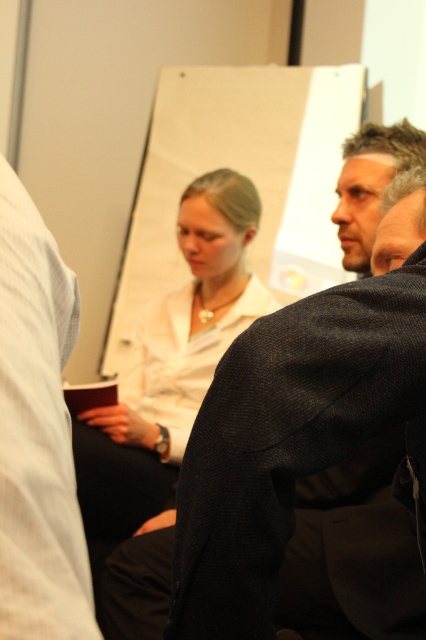
Question: Is white shirt at left bigger than white matte shirt at center?

Choices:
 (A) yes
 (B) no

Answer: (B)

Question: Estimate the real-world distances between objects in this image. Which object is farther from the white matte shirt at center?

Choices:
 (A) dark gray suit at center
 (B) dark gray suit at upper right
 (C) white shirt at left

Answer: (C)

Question: Which of these objects is positioned farthest from the white shirt at left?

Choices:
 (A) dark gray suit at center
 (B) dark gray suit at upper right

Answer: (B)

Question: Is white shirt at left to the right of white matte shirt at center from the viewer's perspective?

Choices:
 (A) no
 (B) yes

Answer: (B)

Question: Can you confirm if white shirt at left is positioned to the right of dark gray suit at upper right?

Choices:
 (A) no
 (B) yes

Answer: (A)

Question: Which point is farther to the camera?

Choices:
 (A) (397, 157)
 (B) (176, 605)

Answer: (A)